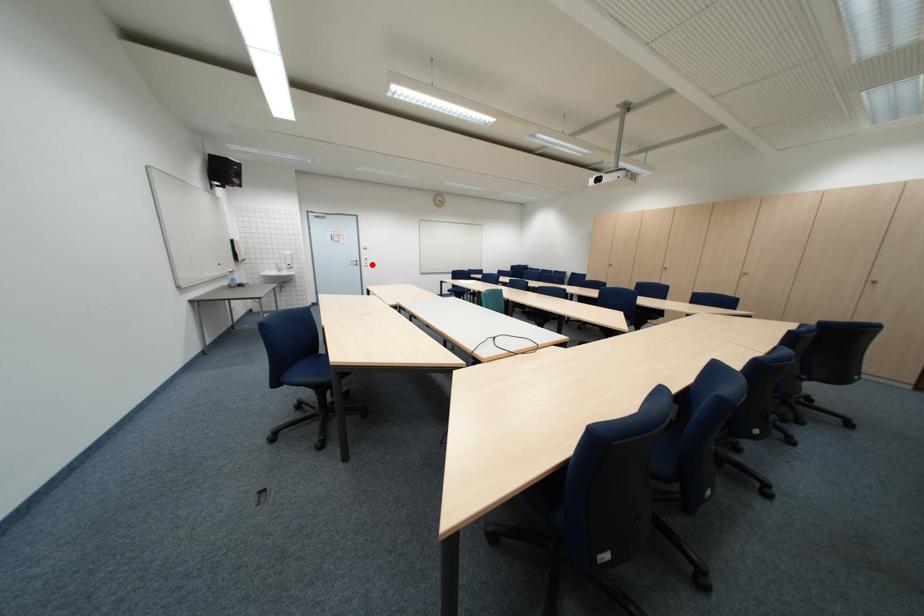
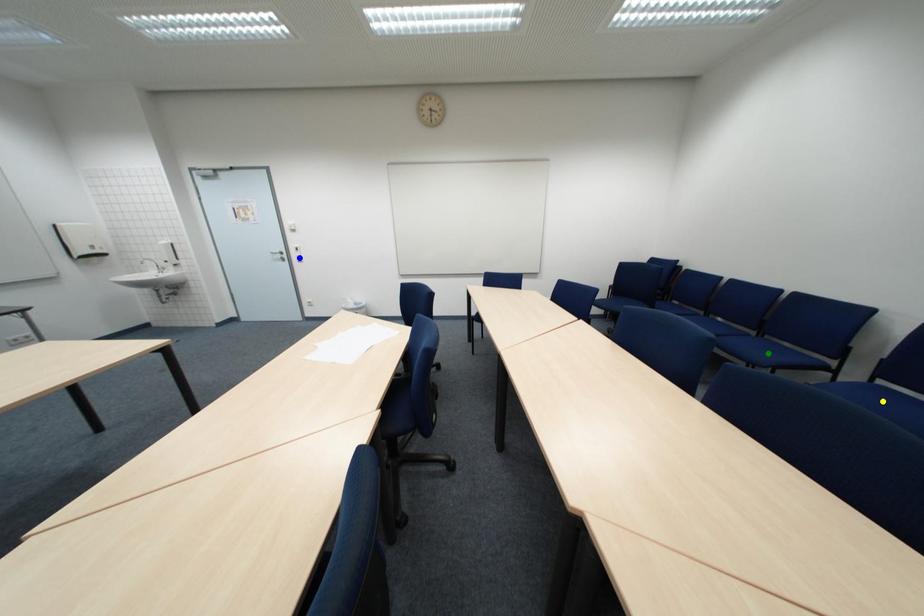
Question: I am providing you with two images of the same scene from different viewpoints. A red point is marked on the first image. You are given multiple points on the second image. Which point in image 2 represents the same 3d spot as the red point in image 1?

Choices:
 (A) green point
 (B) blue point
 (C) yellow point

Answer: (B)